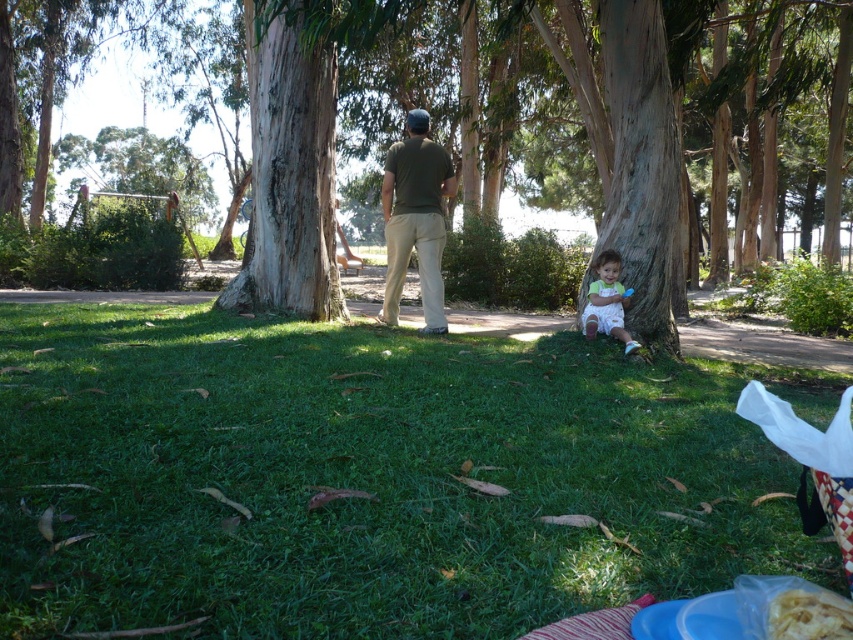
You are a photographer standing in the park and want to capture a photo of the green grass at lower center and the brown textured tree at center. Where should you position yourself to ensure both are visible in the frame?

To capture both the green grass at lower center and the brown textured tree at center, position yourself so that the green grass at lower center is at the bottom of the frame and the brown textured tree at center is above it, since the green grass at lower center is positioned under the brown textured tree at center.

You are standing at the point labeled as point [370,476] in the image. Looking around, you see a grassy area with fallen leaves. What is directly under your feet?

The point [370,476] is on green grass at lower center, so the area directly under your feet is green grass at lower center.